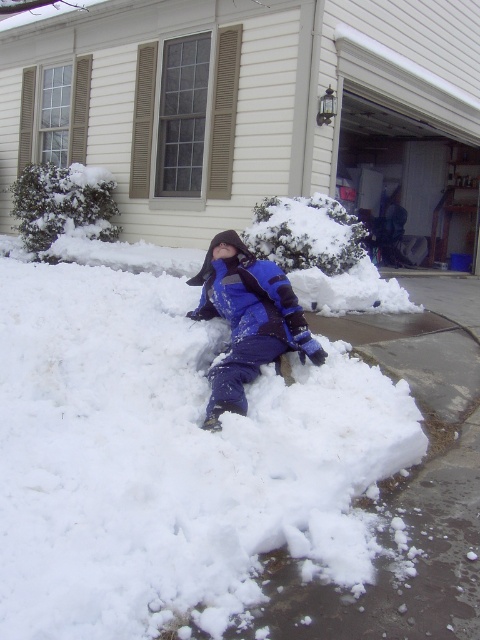
You are a delivery person who needs to deliver a package to the house. You see the white fluffy snow at center and the blue fleece jacket at center. Which one is higher in height?

The white fluffy snow at center is much taller than the blue fleece jacket at center, so the snow is higher in height.

You are a delivery person who needs to place a package on the snow near the blue fleece jacket at center. Can you estimate whether the package will be placed on the white fluffy snow at center if you put it 24 inches away from the jacket?

The white fluffy snow at center and blue fleece jacket at center are 23.40 inches apart. Placing the package 24 inches away from the jacket would mean it is slightly further than the existing distance between the jacket and the snow, so the package might land just beyond the white fluffy snow at center.

You are a delivery person trying to deliver a package to the house. You see the white fluffy snow at center and the blue fleece jacket at center. Which one is bigger in size?

The white fluffy snow at center is larger in size than the blue fleece jacket at center.